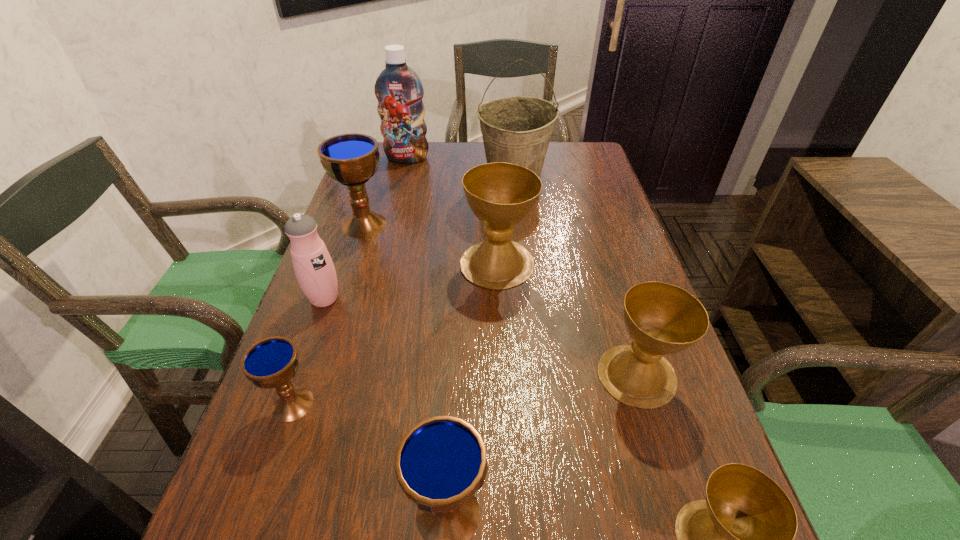
I want to click on chalice at the right edge, so click(x=662, y=319).

Where is `object present at the far left corner`? object present at the far left corner is located at coordinates (398, 89).

This screenshot has width=960, height=540. Identify the location of object that is positioned at the far right corner. (517, 130).

In the image, there is a desktop. Find the location of `free space at the far edge`. free space at the far edge is located at coordinates (455, 159).

At what (x,y) coordinates should I click in order to perform the action: click on vacant space at the left edge of the desktop. Please return your answer as a coordinate pair (x, y). The height and width of the screenshot is (540, 960). Looking at the image, I should click on (382, 276).

Image resolution: width=960 pixels, height=540 pixels. Find the location of `vacant area at the right edge`. vacant area at the right edge is located at coordinates (654, 418).

Find the location of a particular element. free region at the far right corner is located at coordinates (568, 160).

This screenshot has height=540, width=960. What are the coordinates of `empty space between the blue shampoo and the wine bucket` in the screenshot? It's located at (461, 166).

Locate an element on the screen. empty space between the leftmost brown chalice and the thermos bottle is located at coordinates (411, 281).

You are a GUI agent. You are given a task and a screenshot of the screen. Output one action in this format:
    pyautogui.click(x=<x>, y=<y>)
    Task: Click on the object that stands as the closest to the second farthest blue chalice
    
    Given the screenshot: What is the action you would take?
    pyautogui.click(x=314, y=269)